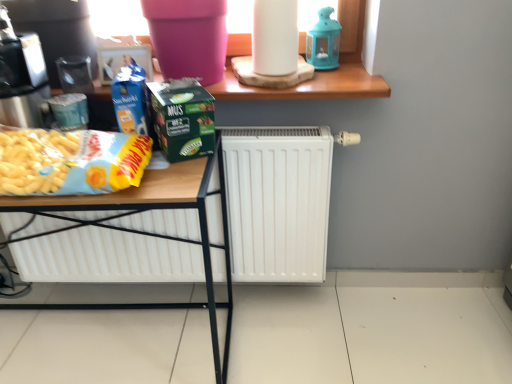
Question: Is blue glass lantern at upper center positioned beyond the bounds of green matte carton at center?

Choices:
 (A) no
 (B) yes

Answer: (B)

Question: Does blue glass lantern at upper center lie in front of green matte carton at center?

Choices:
 (A) yes
 (B) no

Answer: (B)

Question: Is there a large distance between blue glass lantern at upper center and green matte carton at center?

Choices:
 (A) yes
 (B) no

Answer: (B)

Question: Is the surface of blue glass lantern at upper center in direct contact with green matte carton at center?

Choices:
 (A) yes
 (B) no

Answer: (B)

Question: From the image's perspective, is blue glass lantern at upper center above green matte carton at center?

Choices:
 (A) yes
 (B) no

Answer: (A)

Question: Considering the relative sizes of blue glass lantern at upper center and green matte carton at center in the image provided, is blue glass lantern at upper center wider than green matte carton at center?

Choices:
 (A) yes
 (B) no

Answer: (B)

Question: Can you confirm if green matte carton at center is thinner than blue glass lantern at upper center?

Choices:
 (A) no
 (B) yes

Answer: (A)

Question: From the image's perspective, is green matte carton at center located beneath blue glass lantern at upper center?

Choices:
 (A) yes
 (B) no

Answer: (A)

Question: Can you confirm if green matte carton at center is positioned to the left of blue glass lantern at upper center?

Choices:
 (A) yes
 (B) no

Answer: (A)

Question: From the image's perspective, is green matte carton at center on top of blue glass lantern at upper center?

Choices:
 (A) no
 (B) yes

Answer: (A)

Question: Is green matte carton at center beside blue glass lantern at upper center?

Choices:
 (A) no
 (B) yes

Answer: (A)

Question: Can you confirm if green matte carton at center is wider than blue glass lantern at upper center?

Choices:
 (A) yes
 (B) no

Answer: (A)

Question: Can you confirm if white matte paper towel at upper center is smaller than white matte radiator at center?

Choices:
 (A) yes
 (B) no

Answer: (A)